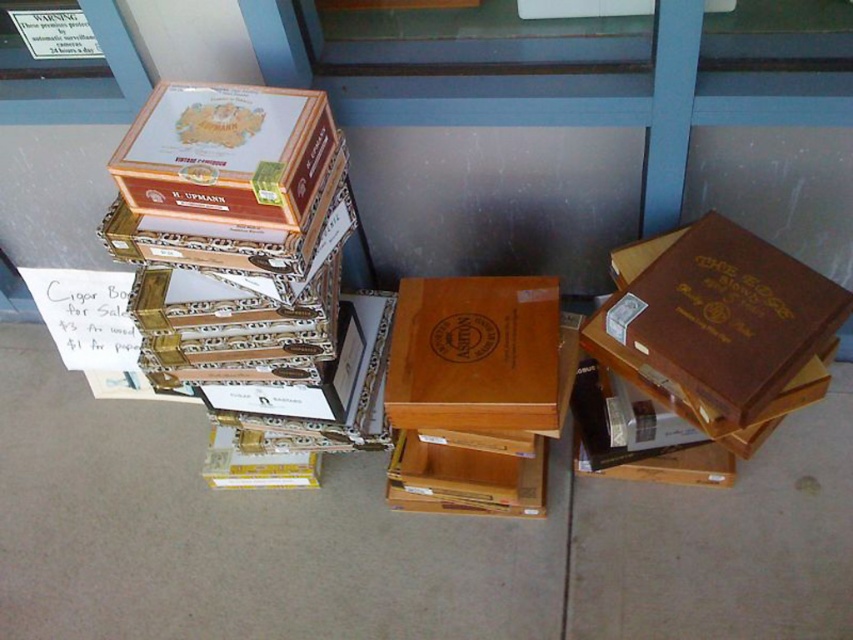
You are standing in front of the cigar boxes and want to pick up the item at point (x=62, y=598) and point (x=543, y=424). Which point is closer to you?

Point (x=62, y=598) is closer to you because it is further to the camera than point (x=543, y=424).

You are a customer looking to buy items from the cigar boxes for sale. You see the brown leather book at right and the matte brown wooden box at center. Which item is closer to you?

The brown leather book at right is closer to you because it is in front of the matte brown wooden box at center.

You are a customer looking to buy a box for storing small items. You see the matte brown cigar box at upper left and the matte brown wooden box at center. Which one is taller?

The matte brown wooden box at center is taller than the matte brown cigar box at upper left.